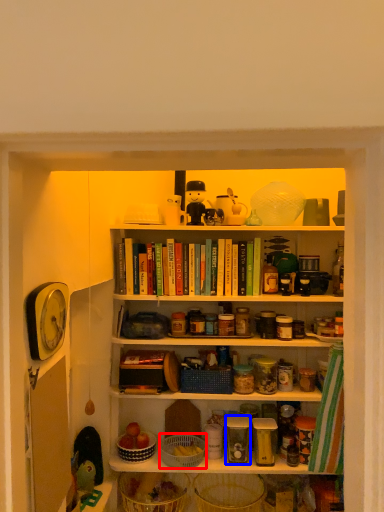
Question: Which point is closer to the camera, basket (highlighted by a red box) or glass jar (highlighted by a blue box)?

Choices:
 (A) basket
 (B) glass jar

Answer: (A)